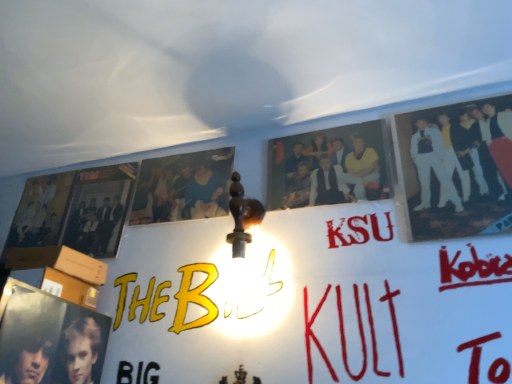
Where is `matte black poster at left`? The height and width of the screenshot is (384, 512). matte black poster at left is located at coordinates (99, 209).

Measure the distance between blue cotton shirt at upper center, which is the 3th person from right to left, and camera.

3.92 feet.

Looking at this image, measure the distance between point (458, 159) and camera.

They are 1.03 meters apart.

Where is `matte black poster at left`? The width and height of the screenshot is (512, 384). matte black poster at left is located at coordinates (99, 209).

Can you confirm if blue cotton shirt at upper center, arranged as the 1th person when viewed from the left, is bigger than white glossy suit at upper right, acting as the 1th person starting from the right?

Actually, blue cotton shirt at upper center, arranged as the 1th person when viewed from the left, might be smaller than white glossy suit at upper right, acting as the 1th person starting from the right.

Considering the positions of point (192, 210) and point (422, 151), is point (192, 210) closer or farther from the camera than point (422, 151)?

Point (192, 210) is farther from the camera than point (422, 151).

Which object is closer to the camera, blue cotton shirt at upper center, which is the 3th person from right to left, or white glossy suit at upper right, acting as the 1th person starting from the right?

Positioned in front is white glossy suit at upper right, acting as the 1th person starting from the right.

Find the location of a particular element. This screenshot has width=512, height=384. the 2nd person positioned below the matte black photo at center, which is the 2th person in left-to-right order (from the image's perspective) is located at coordinates pos(190,193).

Is matte black photo at center, which is the 2th person in left-to-right order, inside the boundaries of blue cotton shirt at upper center, arranged as the 1th person when viewed from the left, or outside?

matte black photo at center, which is the 2th person in left-to-right order, lies outside blue cotton shirt at upper center, arranged as the 1th person when viewed from the left.

In the scene shown: From the image's perspective, is matte black photo at center, marked as the second person in a right-to-left arrangement, positioned above or below blue cotton shirt at upper center, arranged as the 1th person when viewed from the left?

matte black photo at center, marked as the second person in a right-to-left arrangement, is situated higher than blue cotton shirt at upper center, arranged as the 1th person when viewed from the left, in the image.

Considering the sizes of matte black photo at center, which is the 2th person in left-to-right order, and blue cotton shirt at upper center, which is the 3th person from right to left, in the image, is matte black photo at center, which is the 2th person in left-to-right order, taller or shorter than blue cotton shirt at upper center, which is the 3th person from right to left,?

matte black photo at center, which is the 2th person in left-to-right order, is shorter than blue cotton shirt at upper center, which is the 3th person from right to left.

From a real-world perspective, which is physically below, white glossy suit at upper right, acting as the 1th person starting from the right, or matte black poster at left?

From a 3D spatial view, white glossy suit at upper right, acting as the 1th person starting from the right, is below.

From the image's perspective, which one is positioned higher, white glossy suit at upper right, acting as the 1th person starting from the right, or matte black poster at left?

white glossy suit at upper right, acting as the 1th person starting from the right, appears higher in the image.

Considering the relative sizes of white glossy suit at upper right, acting as the 1th person starting from the right, and blue cotton shirt at upper center, arranged as the 1th person when viewed from the left, in the image provided, is white glossy suit at upper right, acting as the 1th person starting from the right, smaller than blue cotton shirt at upper center, arranged as the 1th person when viewed from the left,?

No, white glossy suit at upper right, acting as the 1th person starting from the right, is not smaller than blue cotton shirt at upper center, arranged as the 1th person when viewed from the left.

Is white glossy suit at upper right, the 3th person when ordered from left to right, thinner than blue cotton shirt at upper center, which is the 3th person from right to left?

Incorrect, the width of white glossy suit at upper right, the 3th person when ordered from left to right, is not less than that of blue cotton shirt at upper center, which is the 3th person from right to left.

Is point (459, 124) positioned behind point (183, 166)?

No.

From a real-world perspective, is white glossy suit at upper right, the 3th person when ordered from left to right, positioned above or below blue cotton shirt at upper center, which is the 3th person from right to left?

Clearly, from a real-world perspective, white glossy suit at upper right, the 3th person when ordered from left to right, is below blue cotton shirt at upper center, which is the 3th person from right to left.

Considering the points (430, 193) and (303, 154), which point is behind, point (430, 193) or point (303, 154)?

Point (303, 154)

Who is more distant, white glossy suit at upper right, acting as the 1th person starting from the right, or matte black photo at center, marked as the second person in a right-to-left arrangement?

matte black photo at center, marked as the second person in a right-to-left arrangement, is behind.

Is matte black photo at center, marked as the second person in a right-to-left arrangement, at the back of white glossy suit at upper right, acting as the 1th person starting from the right?

No, white glossy suit at upper right, acting as the 1th person starting from the right,'s orientation is not away from matte black photo at center, marked as the second person in a right-to-left arrangement.

Considering the relative sizes of white glossy suit at upper right, the 3th person when ordered from left to right, and matte black photo at center, which is the 2th person in left-to-right order, in the image provided, is white glossy suit at upper right, the 3th person when ordered from left to right, thinner than matte black photo at center, which is the 2th person in left-to-right order,?

In fact, white glossy suit at upper right, the 3th person when ordered from left to right, might be wider than matte black photo at center, which is the 2th person in left-to-right order.

Could you tell me if matte black photo at center, which is the 2th person in left-to-right order, is facing white glossy suit at upper right, the 3th person when ordered from left to right?

No, matte black photo at center, which is the 2th person in left-to-right order, is not turned towards white glossy suit at upper right, the 3th person when ordered from left to right.

Measure the distance from matte black photo at center, which is the 2th person in left-to-right order, to white glossy suit at upper right, the 3th person when ordered from left to right.

The distance of matte black photo at center, which is the 2th person in left-to-right order, from white glossy suit at upper right, the 3th person when ordered from left to right, is 7.24 inches.

Considering the relative sizes of matte black photo at center, which is the 2th person in left-to-right order, and white glossy suit at upper right, the 3th person when ordered from left to right, in the image provided, is matte black photo at center, which is the 2th person in left-to-right order, shorter than white glossy suit at upper right, the 3th person when ordered from left to right,?

Correct, matte black photo at center, which is the 2th person in left-to-right order, is not as tall as white glossy suit at upper right, the 3th person when ordered from left to right.

From a real-world perspective, is matte black poster at left positioned above or below white glossy suit at upper right, acting as the 1th person starting from the right?

In terms of real-world spatial position, matte black poster at left is above white glossy suit at upper right, acting as the 1th person starting from the right.

This screenshot has width=512, height=384. There is a matte black poster at left. Find the location of `the 2nd person above it (from the image's perspective)`. the 2nd person above it (from the image's perspective) is located at coordinates (445, 159).

How distant is matte black poster at left from white glossy suit at upper right, the 3th person when ordered from left to right?

matte black poster at left and white glossy suit at upper right, the 3th person when ordered from left to right, are 94.18 centimeters apart.

I want to click on the 2nd person to the right of the blue cotton shirt at upper center, which is the 3th person from right to left, counting from the anchor's position, so click(445, 159).

You are a GUI agent. You are given a task and a screenshot of the screen. Output one action in this format:
    pyautogui.click(x=<x>, y=<y>)
    Task: Click on the 2nd person below when counting from the matte black photo at center, marked as the second person in a right-to-left arrangement (from the image's perspective)
    The width and height of the screenshot is (512, 384).
    Given the screenshot: What is the action you would take?
    pyautogui.click(x=190, y=193)

Based on their spatial positions, is blue cotton shirt at upper center, arranged as the 1th person when viewed from the left, or matte black poster at left further from white glossy suit at upper right, the 3th person when ordered from left to right?

Among the two, matte black poster at left is located further to white glossy suit at upper right, the 3th person when ordered from left to right.

Based on their spatial positions, is matte black poster at left or white glossy suit at upper right, acting as the 1th person starting from the right, further from blue cotton shirt at upper center, which is the 3th person from right to left?

white glossy suit at upper right, acting as the 1th person starting from the right, is positioned further to the anchor blue cotton shirt at upper center, which is the 3th person from right to left.

Which object lies further to the anchor point blue cotton shirt at upper center, arranged as the 1th person when viewed from the left, white glossy suit at upper right, the 3th person when ordered from left to right, or matte black poster at left?

white glossy suit at upper right, the 3th person when ordered from left to right, is further to blue cotton shirt at upper center, arranged as the 1th person when viewed from the left.

Based on their spatial positions, is white glossy suit at upper right, acting as the 1th person starting from the right, or matte black photo at center, marked as the second person in a right-to-left arrangement, further from blue cotton shirt at upper center, which is the 3th person from right to left?

The object further to blue cotton shirt at upper center, which is the 3th person from right to left, is white glossy suit at upper right, acting as the 1th person starting from the right.

When comparing their distances from matte black poster at left, does white glossy suit at upper right, acting as the 1th person starting from the right, or blue cotton shirt at upper center, which is the 3th person from right to left, seem closer?

Among the two, blue cotton shirt at upper center, which is the 3th person from right to left, is located nearer to matte black poster at left.

From the image, which object appears to be nearer to blue cotton shirt at upper center, which is the 3th person from right to left, matte black poster at left or matte black photo at center, marked as the second person in a right-to-left arrangement?

The object closer to blue cotton shirt at upper center, which is the 3th person from right to left, is matte black poster at left.

Based on their spatial positions, is matte black photo at center, which is the 2th person in left-to-right order, or blue cotton shirt at upper center, which is the 3th person from right to left, further from white glossy suit at upper right, acting as the 1th person starting from the right?

The object further to white glossy suit at upper right, acting as the 1th person starting from the right, is blue cotton shirt at upper center, which is the 3th person from right to left.

From the image, which object appears to be nearer to matte black photo at center, marked as the second person in a right-to-left arrangement, white glossy suit at upper right, acting as the 1th person starting from the right, or blue cotton shirt at upper center, which is the 3th person from right to left?

white glossy suit at upper right, acting as the 1th person starting from the right, lies closer to matte black photo at center, marked as the second person in a right-to-left arrangement, than the other object.

In order to click on person located between matte black poster at left and matte black photo at center, which is the 2th person in left-to-right order, in the left-right direction in this screenshot , I will do `click(190, 193)`.

You are a GUI agent. You are given a task and a screenshot of the screen. Output one action in this format:
    pyautogui.click(x=<x>, y=<y>)
    Task: Click on the person located between blue cotton shirt at upper center, which is the 3th person from right to left, and white glossy suit at upper right, the 3th person when ordered from left to right, in the left-right direction
    The height and width of the screenshot is (384, 512).
    Given the screenshot: What is the action you would take?
    pyautogui.click(x=323, y=152)